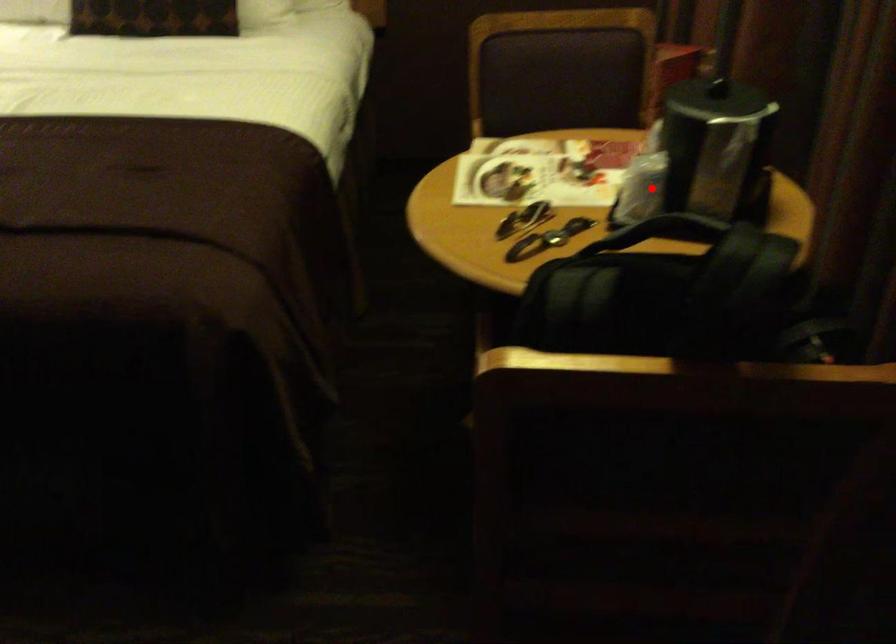
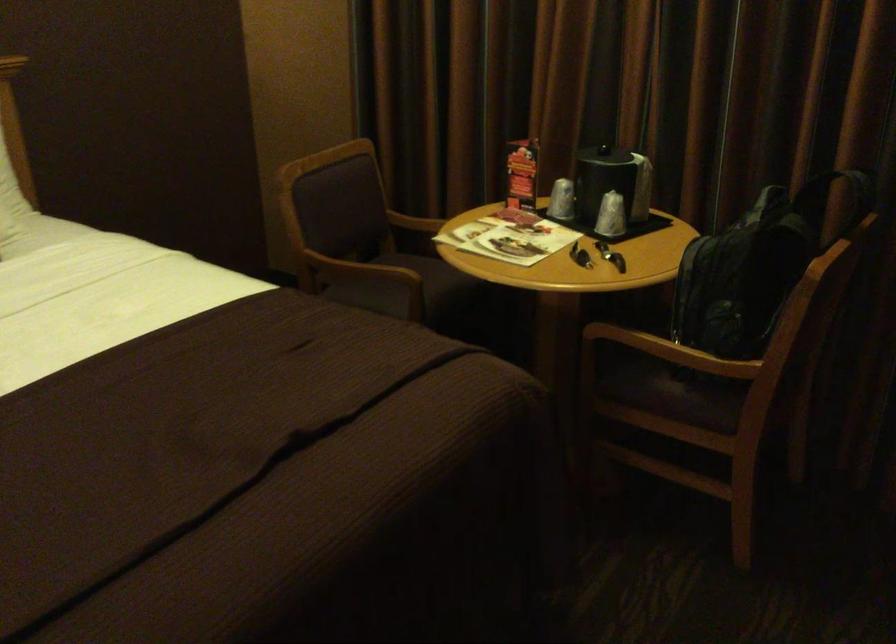
Question: I am providing you with two images of the same scene from different viewpoints. A red point is shown in image1. For the corresponding object point in image2, is it positioned nearer or farther from the camera?

Choices:
 (A) Nearer
 (B) Farther

Answer: (B)